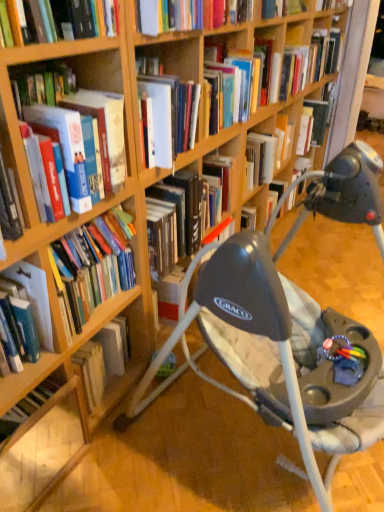
Question: Is hardcover book at upper right, the fifth book from the bottom, taller or shorter than hardcover book at left, which ranks as the fourth book in top-to-bottom order?

Choices:
 (A) short
 (B) tall

Answer: (A)

Question: From the image's perspective, relative to hardcover book at left, the third book from the back, is hardcover book at upper right, the fifth book from the bottom, above or below?

Choices:
 (A) below
 (B) above

Answer: (B)

Question: Based on their relative distances, which object is farther from the hardcover book at upper right, marked as the 5th book in a left-to-right arrangement?

Choices:
 (A) hardcover book at left, the 3th book when ordered from left to right
 (B) hardcover book at lower left, which is the 5th book in right-to-left order
 (C) hardcover book at left, the 4th book viewed from the right
 (D) hardcover book at upper right, which is the fourth book in bottom-to-top order
 (E) matte black baby swing at center

Answer: (B)

Question: Which object is positioned farthest from the hardcover book at lower left, positioned as the first book in left-to-right order?

Choices:
 (A) hardcover book at left, the 3th book when ordered from left to right
 (B) hardcover book at upper right, marked as the 1th book in a back-to-front arrangement
 (C) matte black baby swing at center
 (D) hardcover book at left, which is the 2th book from bottom to top
 (E) hardcover book at upper right, the fourth book from the left

Answer: (B)